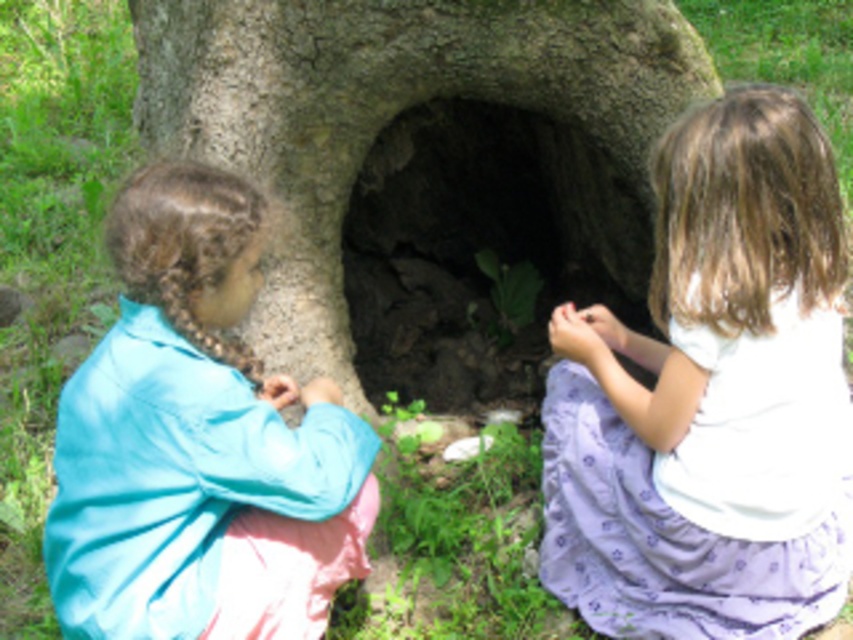
Does white cotton shirt at center have a lesser width compared to blue fabric shirt at left?

No, white cotton shirt at center is not thinner than blue fabric shirt at left.

Can you confirm if white cotton shirt at center is positioned to the left of blue fabric shirt at left?

Incorrect, white cotton shirt at center is not on the left side of blue fabric shirt at left.

Locate an element on the screen. The width and height of the screenshot is (853, 640). white cotton shirt at center is located at coordinates (712, 397).

Can you confirm if white cotton shirt at center is shorter than dark stone hole at center?

No.

Does white cotton shirt at center appear on the right side of dark stone hole at center?

Indeed, white cotton shirt at center is positioned on the right side of dark stone hole at center.

Between point (730, 131) and point (448, 294), which one is positioned in front?

Positioned in front is point (730, 131).

Image resolution: width=853 pixels, height=640 pixels. In order to click on white cotton shirt at center in this screenshot , I will do `click(712, 397)`.

Image resolution: width=853 pixels, height=640 pixels. Describe the element at coordinates (198, 442) in the screenshot. I see `blue fabric shirt at left` at that location.

Can you confirm if blue fabric shirt at left is taller than dark stone hole at center?

Yes.

You are a GUI agent. You are given a task and a screenshot of the screen. Output one action in this format:
    pyautogui.click(x=<x>, y=<y>)
    Task: Click on the blue fabric shirt at left
    This screenshot has height=640, width=853.
    Given the screenshot: What is the action you would take?
    pyautogui.click(x=198, y=442)